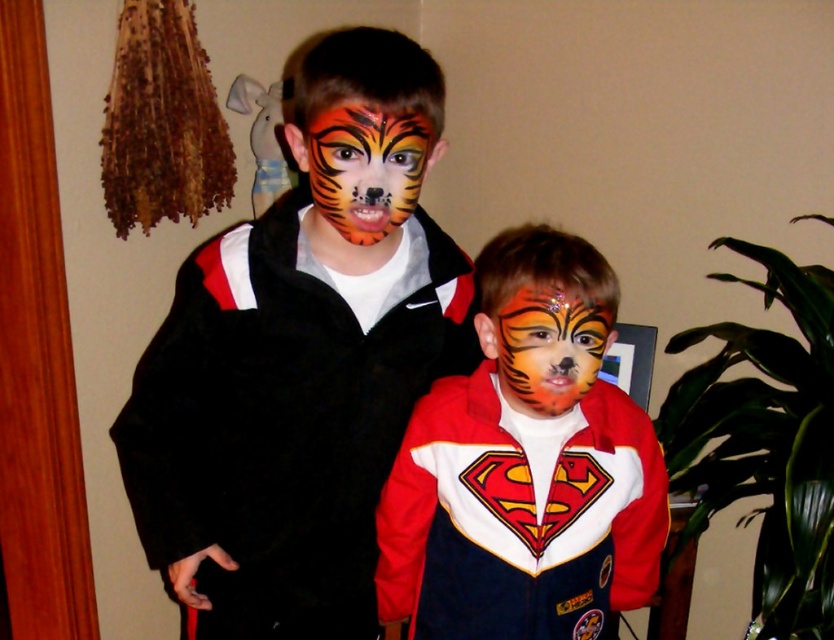
Question: Is matte black jacket at left closer to camera compared to matte red jacket at center?

Choices:
 (A) yes
 (B) no

Answer: (A)

Question: Which object is closer to the camera taking this photo?

Choices:
 (A) matte red jacket at center
 (B) matte black jacket at left

Answer: (B)

Question: Does matte black jacket at left appear over shiny orange tiger face paint at center?

Choices:
 (A) yes
 (B) no

Answer: (B)

Question: Among these objects, which one is farthest from the camera?

Choices:
 (A) matte red jacket at center
 (B) shiny orange tiger face paint at center
 (C) matte black jacket at left
 (D) orange matte tiger face paint at center

Answer: (B)

Question: Which of the following is the closest to the observer?

Choices:
 (A) (498, 364)
 (B) (350, 435)
 (C) (521, 396)
 (D) (385, 164)

Answer: (D)

Question: Is matte red jacket at center to the left of shiny orange tiger face paint at center from the viewer's perspective?

Choices:
 (A) no
 (B) yes

Answer: (A)